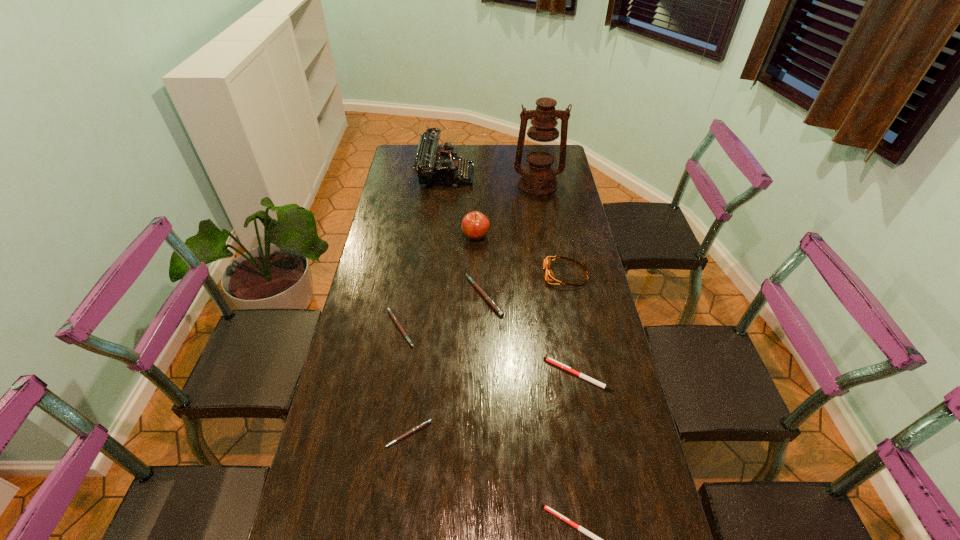
You are a GUI agent. You are given a task and a screenshot of the screen. Output one action in this format:
    pyautogui.click(x=<x>, y=<y>)
    Task: Click on the goggles positioned at the right edge
    
    Given the screenshot: What is the action you would take?
    pyautogui.click(x=549, y=276)

This screenshot has height=540, width=960. In order to click on pen at the right edge in this screenshot , I will do `click(550, 360)`.

The height and width of the screenshot is (540, 960). I want to click on object that is at the far left corner, so click(x=435, y=165).

In the image, there is a desktop. Where is `vacant region at the far edge`? This screenshot has width=960, height=540. vacant region at the far edge is located at coordinates (497, 152).

Where is `vacant region at the left edge`? vacant region at the left edge is located at coordinates (410, 174).

In the image, there is a desktop. Where is `vacant space at the right edge`? The image size is (960, 540). vacant space at the right edge is located at coordinates (570, 290).

Find the location of a particular element. free point between the third pen from right to left and the fourth tallest object is located at coordinates (525, 285).

Where is `vacant space that is in between the oil lamp and the second smallest pink pen`? The image size is (960, 540). vacant space that is in between the oil lamp and the second smallest pink pen is located at coordinates (468, 256).

This screenshot has height=540, width=960. I want to click on blank region between the seventh nearest object and the fourth farthest pen, so click(x=443, y=336).

You are a GUI agent. You are given a task and a screenshot of the screen. Output one action in this format:
    pyautogui.click(x=<x>, y=<y>)
    Task: Click on the free space between the fourth tallest object and the third nearest object
    This screenshot has height=540, width=960.
    Given the screenshot: What is the action you would take?
    pyautogui.click(x=572, y=325)